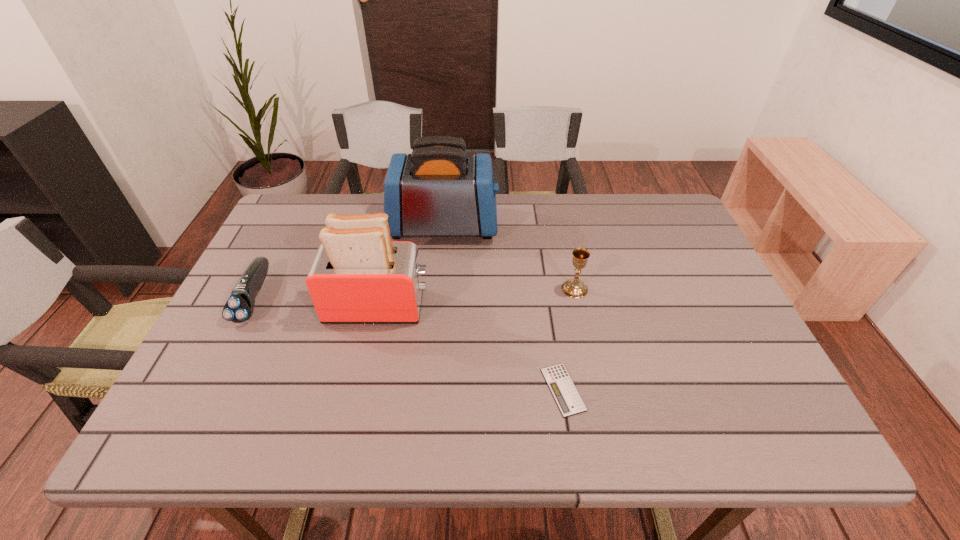
In the image, there is a desktop. Find the location of `vacant space at the far right corner`. vacant space at the far right corner is located at coordinates (644, 221).

The height and width of the screenshot is (540, 960). Identify the location of vacant area that lies between the nearer toaster and the chalice. (476, 298).

The height and width of the screenshot is (540, 960). What are the coordinates of `free spot between the nearer toaster and the chalice` in the screenshot? It's located at (476, 298).

This screenshot has height=540, width=960. What are the coordinates of `vacant space that is in between the calculator and the chalice` in the screenshot? It's located at (569, 339).

Identify the location of vacant area between the chalice and the farther toaster. The height and width of the screenshot is (540, 960). (509, 257).

Select which object is the fourth closest to the shortest object. Please provide its 2D coordinates. Your answer should be formatted as a tuple, i.e. [(x, y)], where the tuple contains the x and y coordinates of a point satisfying the conditions above.

[(239, 307)]

Locate which object ranks third in proximity to the nearer toaster. Please provide its 2D coordinates. Your answer should be formatted as a tuple, i.e. [(x, y)], where the tuple contains the x and y coordinates of a point satisfying the conditions above.

[(565, 394)]

At what (x,y) coordinates should I click in order to perform the action: click on vacant region that satisfies the following two spatial constraints: 1. on the back side of the calculator; 2. on the left side of the third shortest object. Please return your answer as a coordinate pair (x, y). Looking at the image, I should click on 547,289.

Locate an element on the screen. The width and height of the screenshot is (960, 540). free location that satisfies the following two spatial constraints: 1. on the back side of the chalice; 2. on the front-facing side of the farthest object is located at coordinates (561, 225).

Locate an element on the screen. This screenshot has height=540, width=960. blank area in the image that satisfies the following two spatial constraints: 1. on the front-facing side of the farthest object; 2. on the back side of the third shortest object is located at coordinates (438, 289).